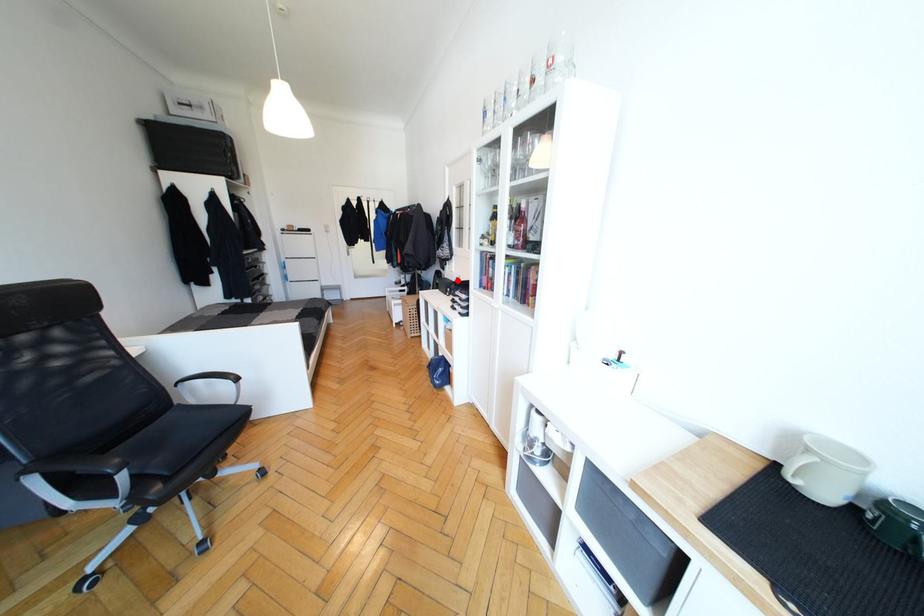
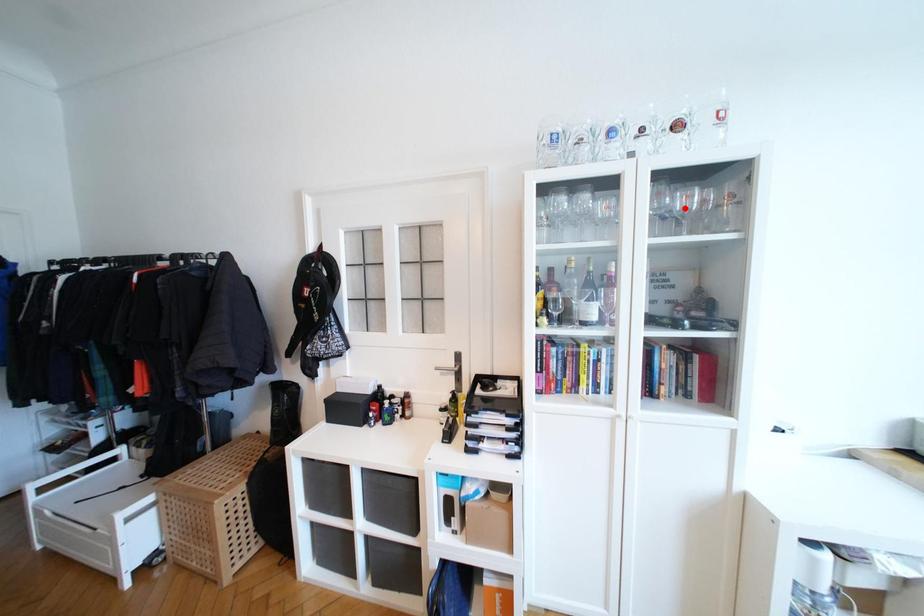
I am providing you with two images of the same scene from different viewpoints. A red point is marked on the first image and another point is marked on the second image. Is the red point in image1 aligned with the point shown in image2?

No